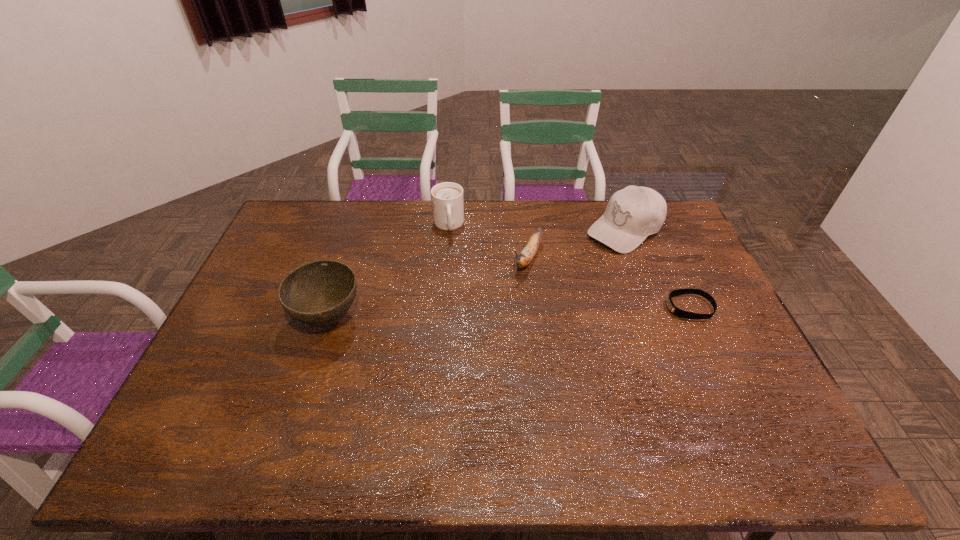
Locate an element on the screen. The height and width of the screenshot is (540, 960). banana that is at the far edge is located at coordinates (529, 251).

At what (x,y) coordinates should I click in order to perform the action: click on cappuccino at the far edge. Please return your answer as a coordinate pair (x, y). The width and height of the screenshot is (960, 540). Looking at the image, I should click on (447, 198).

Find the location of a particular element. wristband located at the right edge is located at coordinates (674, 310).

I want to click on baseball cap located in the right edge section of the desktop, so click(x=632, y=214).

Identify the location of object located at the far right corner. (632, 214).

I want to click on vacant space at the far edge of the desktop, so click(x=372, y=201).

In the image, there is a desktop. At what (x,y) coordinates should I click in order to perform the action: click on vacant region at the near edge. Please return your answer as a coordinate pair (x, y). This screenshot has height=540, width=960. Looking at the image, I should click on (497, 419).

Locate an element on the screen. The image size is (960, 540). vacant area at the left edge is located at coordinates (222, 347).

You are a GUI agent. You are given a task and a screenshot of the screen. Output one action in this format:
    pyautogui.click(x=<x>, y=<y>)
    Task: Click on the free space at the right edge
    The image size is (960, 540).
    Given the screenshot: What is the action you would take?
    pyautogui.click(x=701, y=283)

In the image, there is a desktop. Where is `free space at the far right corner`? free space at the far right corner is located at coordinates (677, 230).